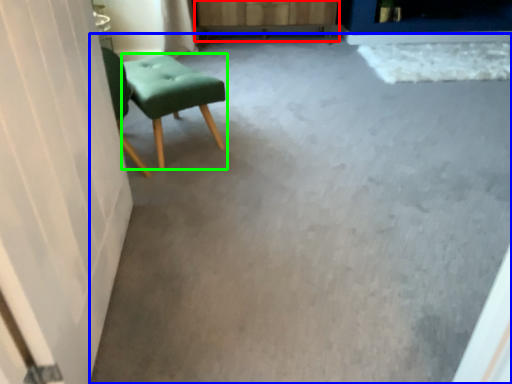
Question: Which is nearer to the dresser (highlighted by a red box)? concrete (highlighted by a blue box) or stool (highlighted by a green box).

Choices:
 (A) concrete
 (B) stool

Answer: (B)